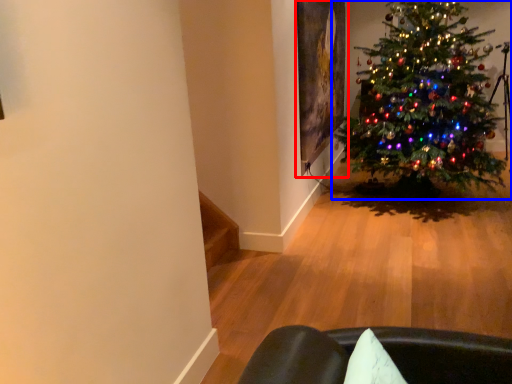
Question: Which of the following is the farthest to the observer, picture frame (highlighted by a red box) or christmas tree (highlighted by a blue box)?

Choices:
 (A) picture frame
 (B) christmas tree

Answer: (A)